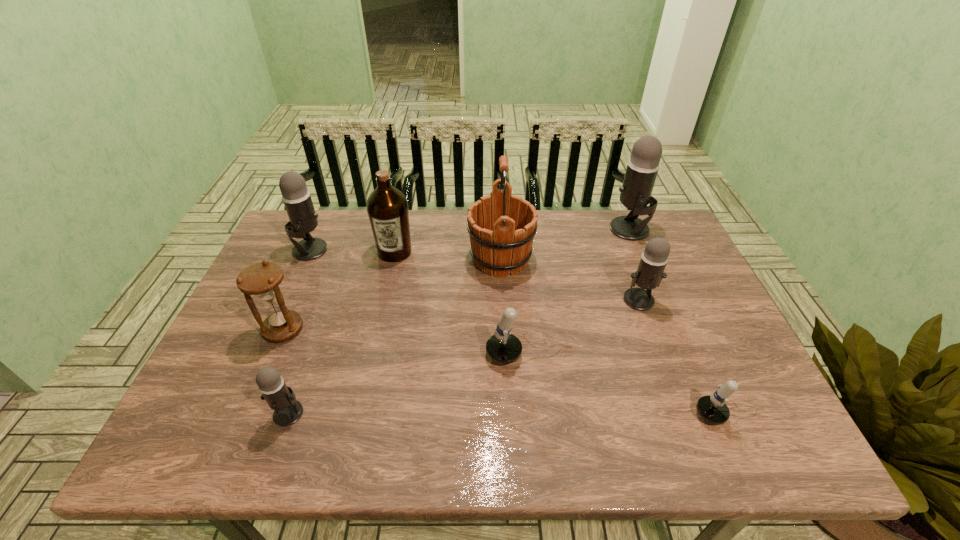
Find the location of a particular element. This screenshot has height=540, width=960. free space located on the right of the hourglass is located at coordinates (334, 329).

This screenshot has width=960, height=540. Identify the location of blank space located on the right of the left white microphone. (684, 355).

This screenshot has height=540, width=960. I want to click on free spot located on the left of the third gray microphone from right to left, so click(251, 413).

At what (x,y) coordinates should I click in order to perform the action: click on free spot located on the front of the shortest microphone. Please return your answer as a coordinate pair (x, y). Image resolution: width=960 pixels, height=540 pixels. Looking at the image, I should click on (751, 456).

This screenshot has height=540, width=960. I want to click on wine bucket that is at the far edge, so click(501, 226).

Find the location of a particular element. The width and height of the screenshot is (960, 540). olive oil at the far edge is located at coordinates (387, 207).

This screenshot has width=960, height=540. I want to click on microphone that is at the left edge, so click(296, 197).

Locate an element on the screen. The height and width of the screenshot is (540, 960). hourglass present at the left edge is located at coordinates (261, 279).

Locate an element on the screen. object located in the far left corner section of the desktop is located at coordinates (296, 197).

Find the location of a particular element. object that is at the far right corner is located at coordinates (635, 193).